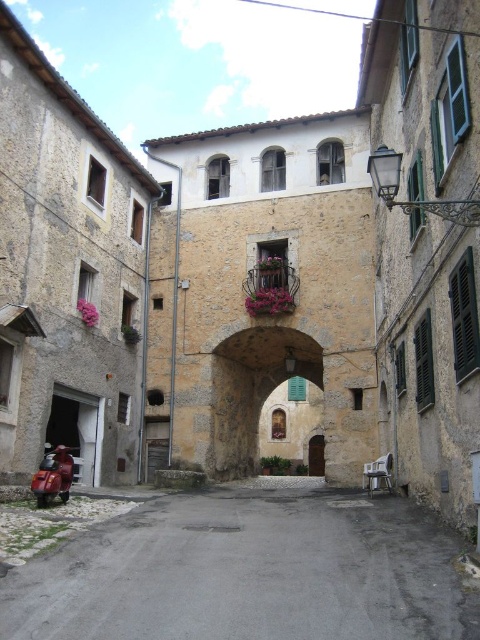
Does gray concrete alley at center have a greater height compared to metallic red scooter at lower left?

In fact, gray concrete alley at center may be shorter than metallic red scooter at lower left.

Who is lower down, gray concrete alley at center or metallic red scooter at lower left?

Positioned lower is gray concrete alley at center.

At what (x,y) coordinates should I click in order to perform the action: click on gray concrete alley at center. Please return your answer as a coordinate pair (x, y). Image resolution: width=480 pixels, height=640 pixels. Looking at the image, I should click on [x=249, y=573].

Can you confirm if gray concrete alley at center is positioned to the right of stone archway at center?

In fact, gray concrete alley at center is to the left of stone archway at center.

Is point (311, 612) positioned before point (236, 436)?

Yes, it is in front of point (236, 436).

You are a GUI agent. You are given a task and a screenshot of the screen. Output one action in this format:
    pyautogui.click(x=<x>, y=<y>)
    Task: Click on the gray concrete alley at center
    
    Given the screenshot: What is the action you would take?
    pyautogui.click(x=249, y=573)

Which is behind, point (309, 365) or point (59, 477)?

The point (309, 365) is behind.

Locate an element on the screen. The width and height of the screenshot is (480, 640). stone archway at center is located at coordinates (252, 388).